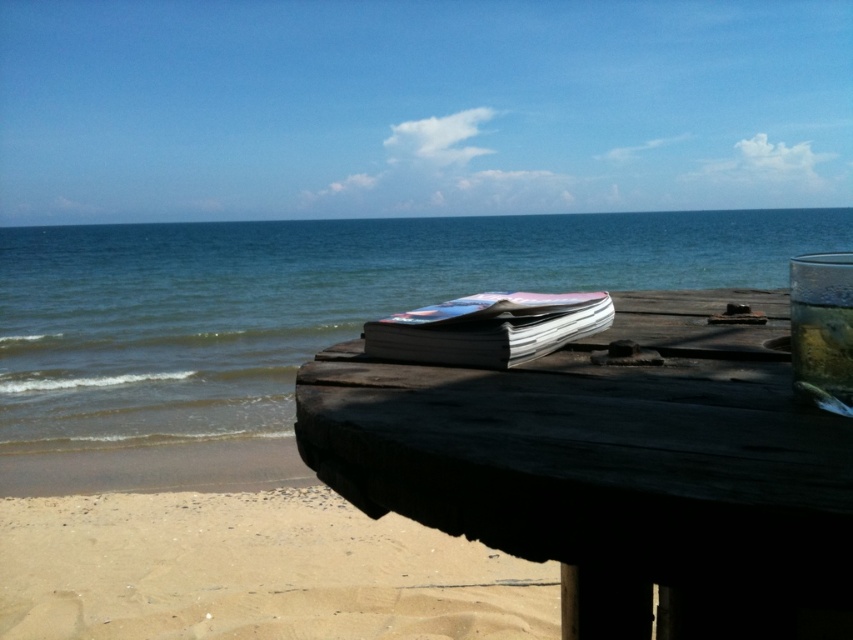
Who is positioned more to the right, dark wood picnic table at center or light beige sand at lower left?

Positioned to the right is dark wood picnic table at center.

Is dark wood picnic table at center bigger than light beige sand at lower left?

No.

Is point (706, 376) farther from camera compared to point (79, 595)?

No, it is not.

This screenshot has height=640, width=853. Find the location of `dark wood picnic table at center`. dark wood picnic table at center is located at coordinates (614, 468).

Is the position of blue water at center less distant than that of white glossy book at center?

No, blue water at center is further to the viewer.

Which of these two, blue water at center or white glossy book at center, stands taller?

blue water at center is taller.

Find the location of `blue water at center`. blue water at center is located at coordinates click(306, 301).

Who is taller, blue water at center or light beige sand at lower left?

blue water at center

What do you see at coordinates (306, 301) in the screenshot? This screenshot has width=853, height=640. I see `blue water at center` at bounding box center [306, 301].

Which is in front, point (57, 342) or point (125, 540)?

Point (125, 540)

You are a GUI agent. You are given a task and a screenshot of the screen. Output one action in this format:
    pyautogui.click(x=<x>, y=<y>)
    Task: Click on the blue water at center
    The width and height of the screenshot is (853, 640).
    Given the screenshot: What is the action you would take?
    pyautogui.click(x=306, y=301)